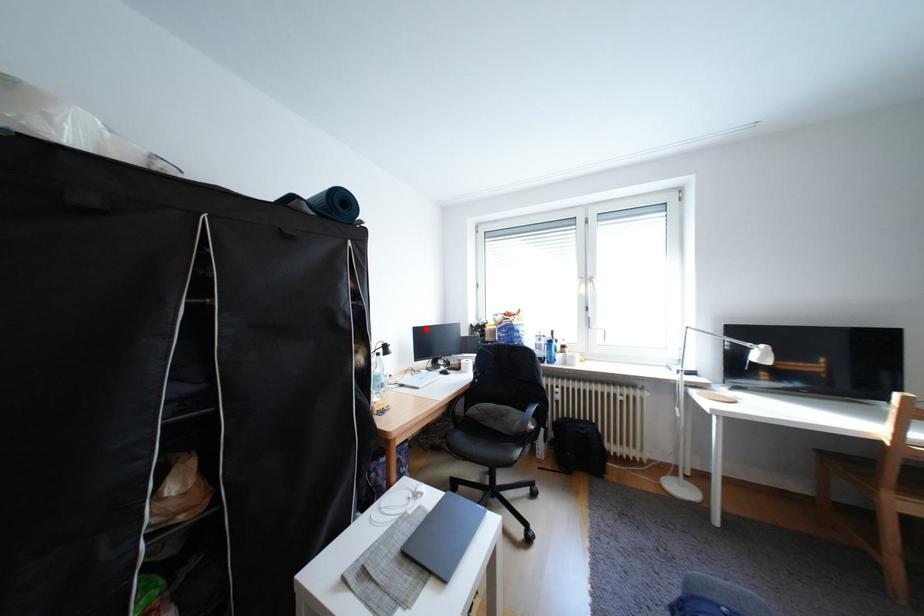
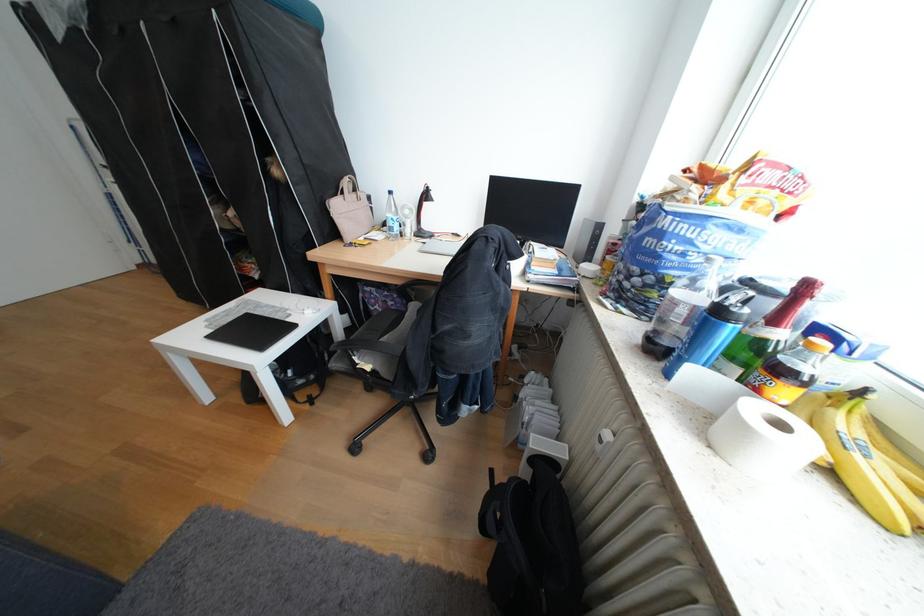
The point at the highlighted location is marked in the first image. Where is the corresponding point in the second image?

(504, 177)